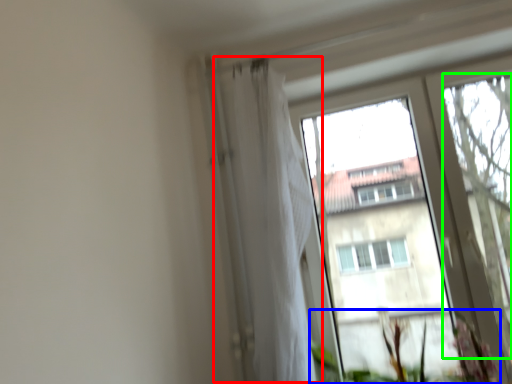
Question: Which object is the closest to the shower curtain (highlighted by a red box)? Choose among these: vegetation (highlighted by a blue box) or tree (highlighted by a green box).

Choices:
 (A) vegetation
 (B) tree

Answer: (A)